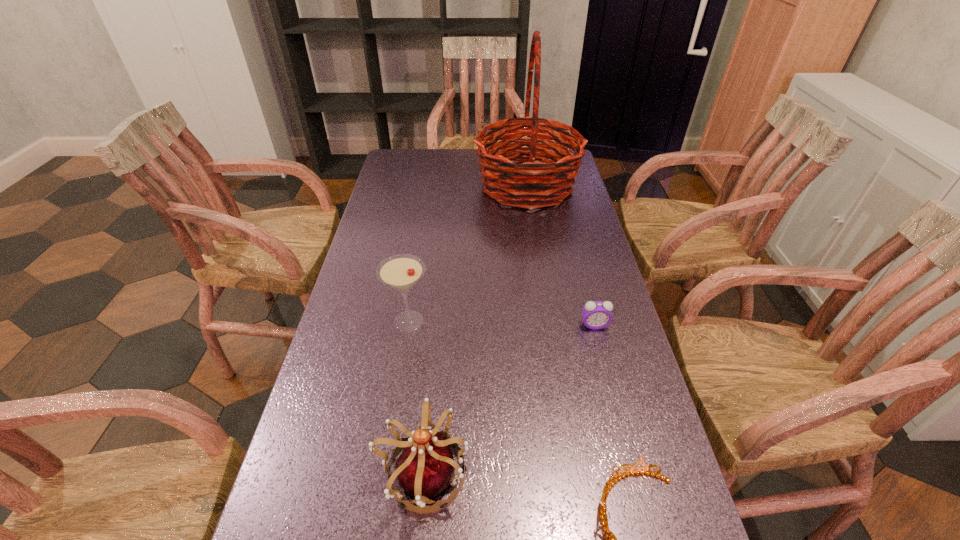
Where is `object that is at the left edge`? The width and height of the screenshot is (960, 540). object that is at the left edge is located at coordinates (402, 271).

Where is `basket present at the right edge`? basket present at the right edge is located at coordinates (546, 183).

Find the location of a particular element. The width and height of the screenshot is (960, 540). alarm clock located at the right edge is located at coordinates (596, 315).

Find the location of a particular element. This screenshot has width=960, height=540. object located in the far right corner section of the desktop is located at coordinates (546, 183).

At what (x,y) coordinates should I click in order to perform the action: click on vacant space at the far edge of the desktop. Please return your answer as a coordinate pair (x, y). This screenshot has height=540, width=960. Looking at the image, I should click on (443, 175).

This screenshot has height=540, width=960. I want to click on free location at the left edge of the desktop, so click(x=367, y=228).

The width and height of the screenshot is (960, 540). In the image, there is a desktop. What are the coordinates of `free region at the right edge` in the screenshot? It's located at (585, 358).

In the image, there is a desktop. Identify the location of vacant space at the far left corner. (413, 167).

I want to click on empty location between the alarm clock and the tallest object, so click(561, 256).

Locate an element on the screen. vacant space in between the alarm clock and the left tiara is located at coordinates (509, 400).